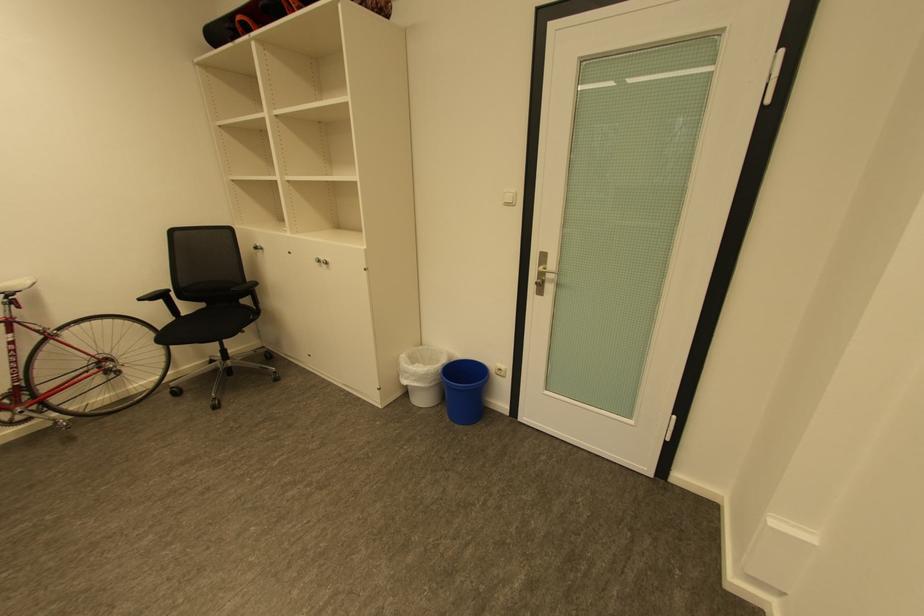
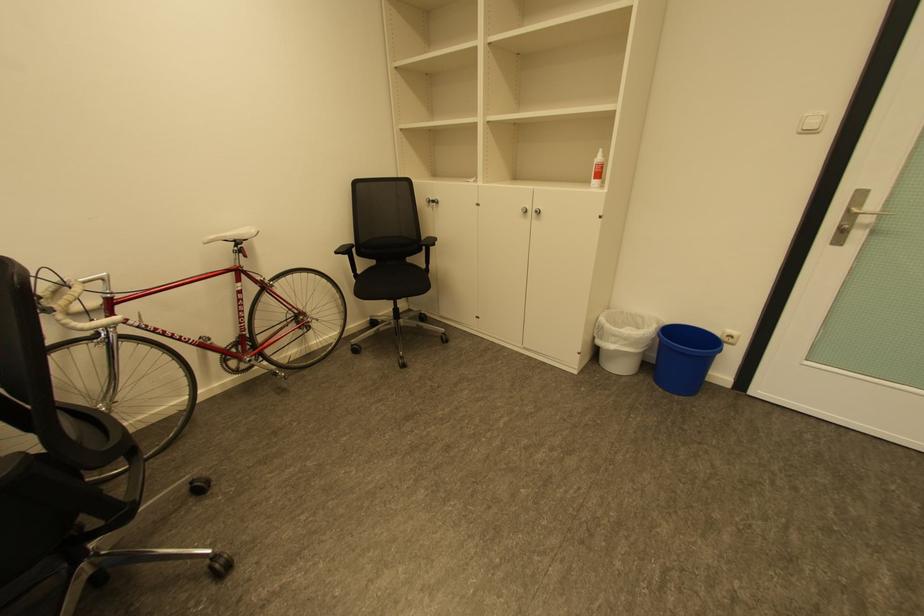
Question: In a continuous first-person perspective shot, in which direction is the camera moving?

Choices:
 (A) Left
 (B) Right
 (C) Forward
 (D) Backward

Answer: (A)